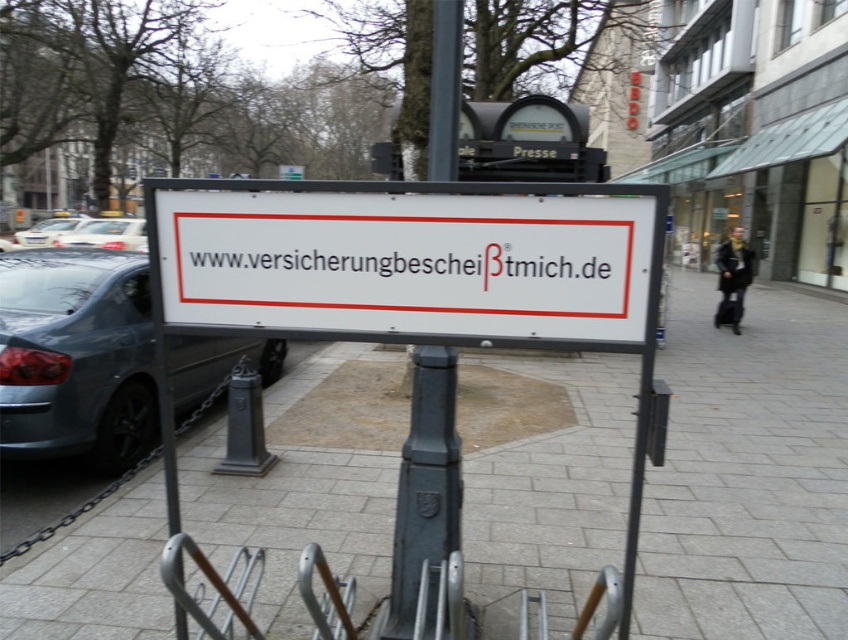
Question: Is white concrete pavement at center smaller than dark gray metal pole at center?

Choices:
 (A) yes
 (B) no

Answer: (B)

Question: Can you confirm if white concrete pavement at center is wider than matte gray car at left?

Choices:
 (A) yes
 (B) no

Answer: (A)

Question: Which point is closer to the camera taking this photo?

Choices:
 (A) (73, 429)
 (B) (391, 563)

Answer: (B)

Question: Does white concrete pavement at center appear under white glossy car at left?

Choices:
 (A) yes
 (B) no

Answer: (A)

Question: Which point is farther to the camera?

Choices:
 (A) dark gray metal pole at center
 (B) white glossy car at upper left
 (C) white plastic sign at center
 (D) white concrete pavement at center

Answer: (B)

Question: Estimate the real-world distances between objects in this image. Which object is farther from the white concrete pavement at center?

Choices:
 (A) dark gray metal pole at center
 (B) white plastic sign at center
 (C) white glossy car at upper left
 (D) matte gray car at left

Answer: (C)